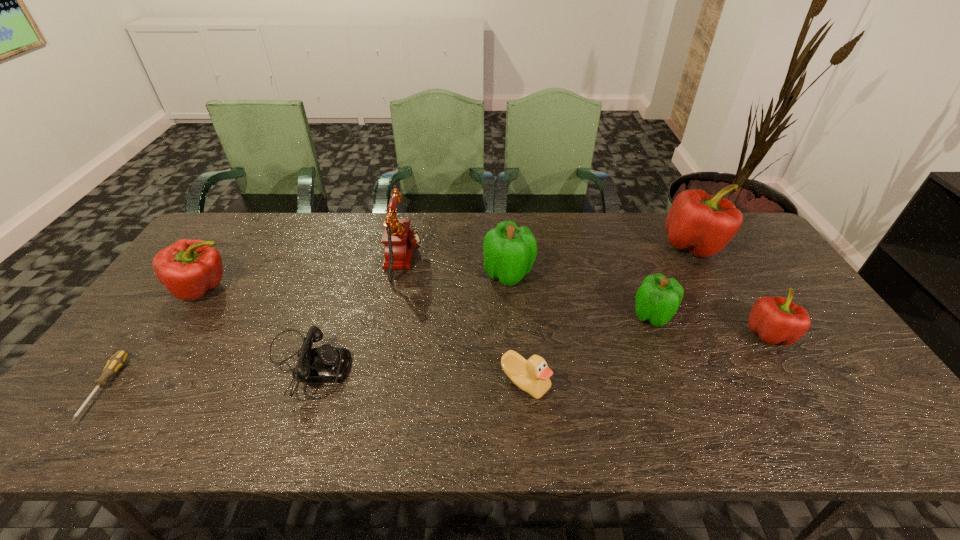
Where is `duck`? This screenshot has width=960, height=540. duck is located at coordinates (533, 375).

This screenshot has height=540, width=960. I want to click on the left telephone, so click(x=326, y=364).

Where is `the second shortest object`? the second shortest object is located at coordinates (326, 364).

What are the coordinates of `gray screwdriver` in the screenshot? It's located at (117, 361).

Identify the location of screwdriver. (117, 361).

The width and height of the screenshot is (960, 540). Find the location of `vacant position located on the right of the farthest pink bell pepper`. vacant position located on the right of the farthest pink bell pepper is located at coordinates (745, 246).

Locate an element on the screen. The width and height of the screenshot is (960, 540). free spot located 0.070m on the dial of the farther telephone is located at coordinates (444, 260).

At what (x,y) coordinates should I click in order to perform the action: click on vacant space located 0.330m on the left of the bigger green bell pepper. Please return your answer as a coordinate pair (x, y). This screenshot has width=960, height=540. Looking at the image, I should click on (375, 274).

Where is `vacant region located 0.150m on the front of the second nearest pink bell pepper`? The width and height of the screenshot is (960, 540). vacant region located 0.150m on the front of the second nearest pink bell pepper is located at coordinates (160, 352).

Image resolution: width=960 pixels, height=540 pixels. I want to click on vacant region located on the front of the right green bell pepper, so pyautogui.click(x=690, y=413).